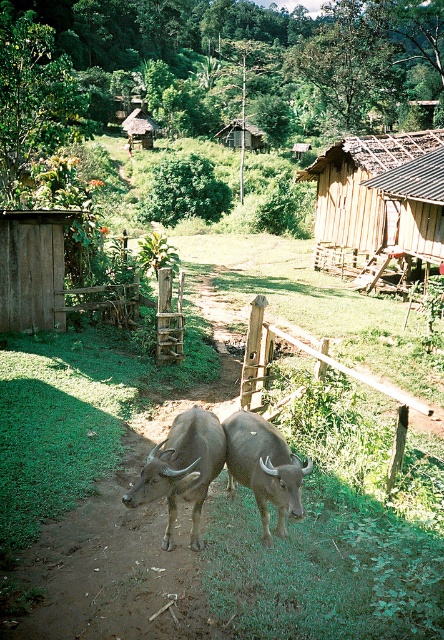
Can you confirm if wooden hut at center is bigger than wooden thatched hut at upper center?

No.

Does wooden hut at center have a lesser height compared to wooden thatched hut at upper center?

Yes.

Who is more forward, (254, 141) or (134, 108)?

Point (254, 141) is more forward.

Identify the location of wooden hut at center. (241, 134).

Which is above, wooden hut at upper right or wooden thatched hut at upper center?

Positioned higher is wooden thatched hut at upper center.

Does wooden hut at upper right have a greater width compared to wooden thatched hut at upper center?

Correct, the width of wooden hut at upper right exceeds that of wooden thatched hut at upper center.

I want to click on wooden hut at upper right, so click(361, 188).

The image size is (444, 640). I want to click on wooden hut at upper right, so click(x=361, y=188).

Is brown rough textured buffalo at center thinner than wooden hut at center?

In fact, brown rough textured buffalo at center might be wider than wooden hut at center.

Between point (229, 486) and point (241, 122), which one is positioned in front?

Point (229, 486)

You are a GUI agent. You are given a task and a screenshot of the screen. Output one action in this format:
    pyautogui.click(x=<x>, y=<y>)
    Task: Click on the brown rough textured buffalo at center
    
    Given the screenshot: What is the action you would take?
    click(264, 467)